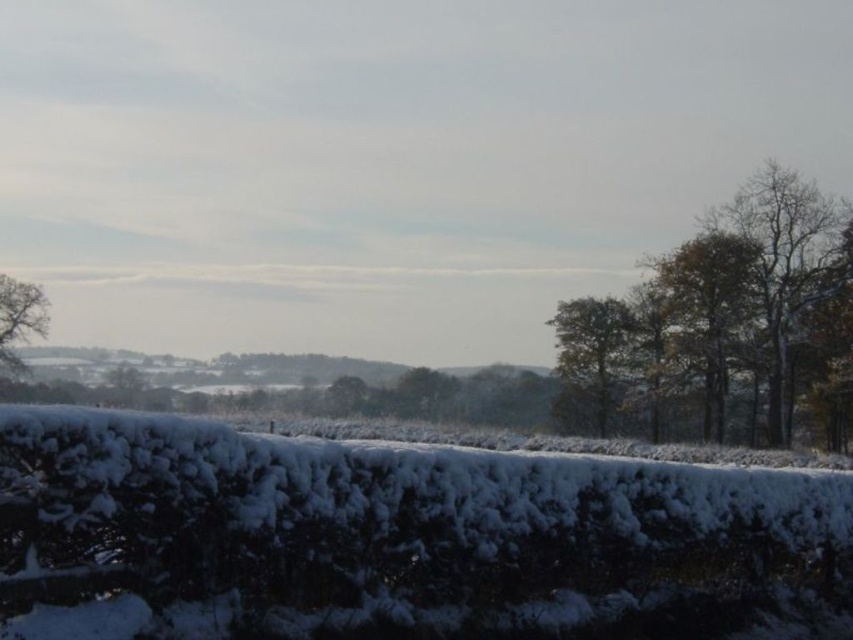
Question: Considering the real-world distances, which object is closest to the brown textured tree at right?

Choices:
 (A) green leafy tree at center
 (B) white fluffy hedge at lower center
 (C) smooth brown tree at left

Answer: (A)

Question: Among these objects, which one is nearest to the camera?

Choices:
 (A) brown textured tree at right
 (B) white fluffy hedge at lower center

Answer: (B)

Question: Is brown textured tree at right to the right of smooth brown tree at left from the viewer's perspective?

Choices:
 (A) yes
 (B) no

Answer: (A)

Question: From the image, what is the correct spatial relationship of white fluffy hedge at lower center in relation to smooth brown tree at left?

Choices:
 (A) left
 (B) right

Answer: (B)

Question: Observing the image, what is the correct spatial positioning of white fluffy hedge at lower center in reference to brown textured tree at right?

Choices:
 (A) right
 (B) left

Answer: (B)

Question: Which object is positioned closest to the brown textured tree at right?

Choices:
 (A) white fluffy hedge at lower center
 (B) green leafy tree at center
 (C) smooth brown tree at left

Answer: (B)